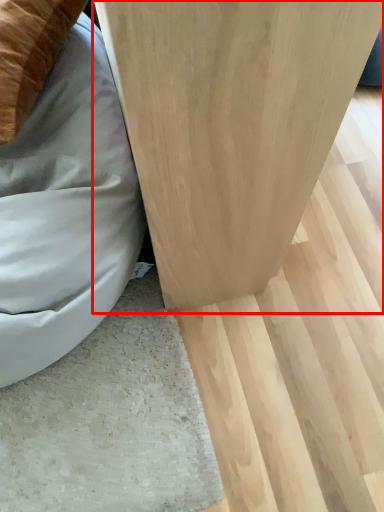
Question: In this image, where is furniture (annotated by the red box) located relative to bean bag chair?

Choices:
 (A) right
 (B) left

Answer: (A)